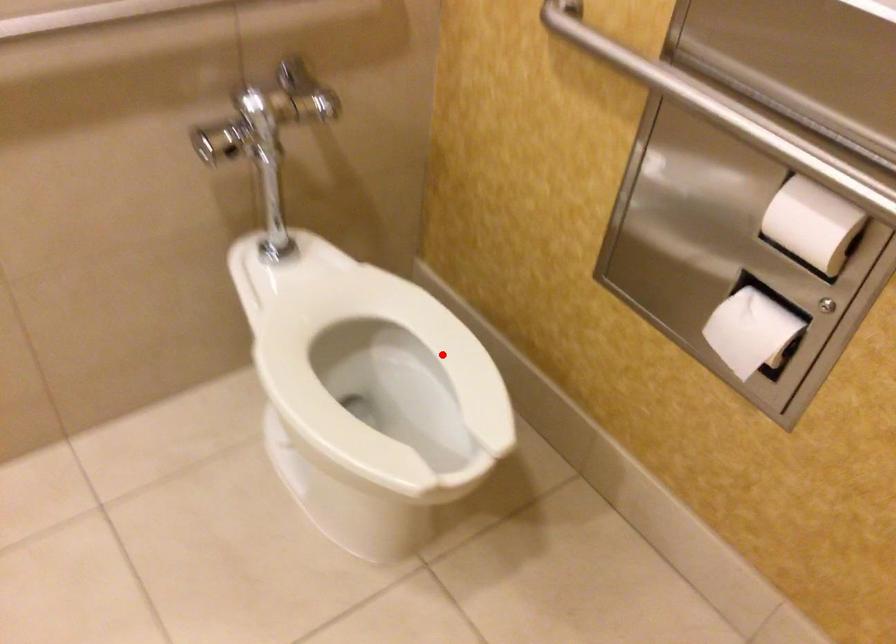
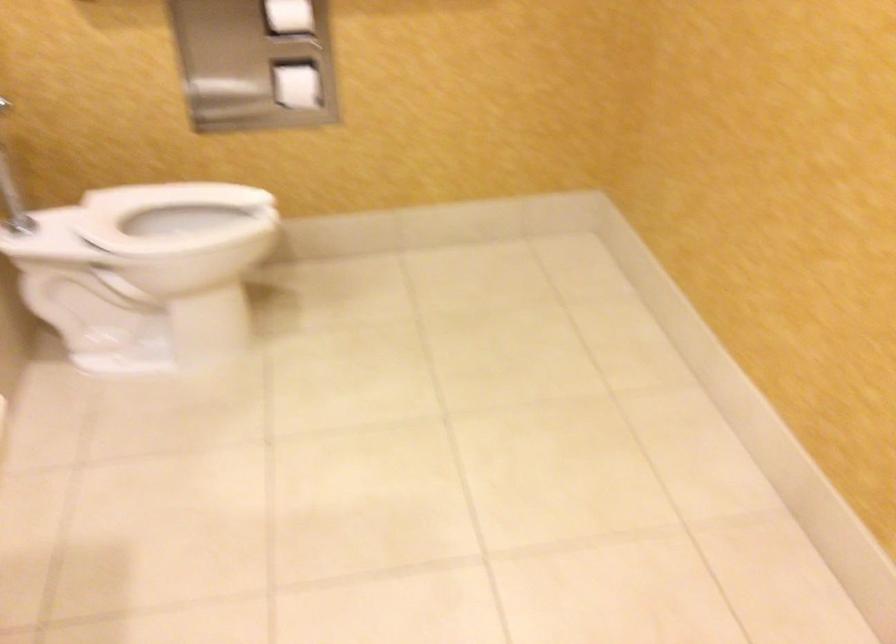
Question: I am providing you with two images of the same scene from different viewpoints. Given a red point in image1, look at the same physical point in image2. Is it:

Choices:
 (A) Closer to the viewpoint
 (B) Farther from the viewpoint

Answer: (B)